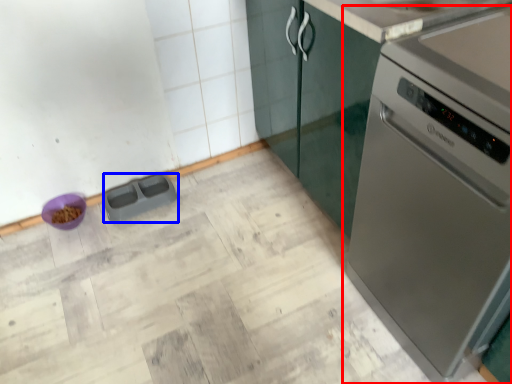
Question: Which point is closer to the camera, home appliance (highlighted by a red box) or appliance (highlighted by a blue box)?

Choices:
 (A) home appliance
 (B) appliance

Answer: (A)